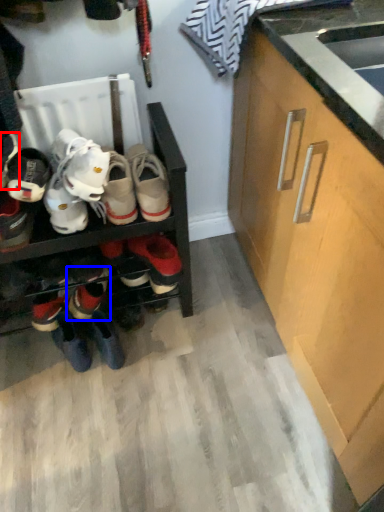
Question: Which object is closer to the camera taking this photo, footwear (highlighted by a red box) or footwear (highlighted by a blue box)?

Choices:
 (A) footwear
 (B) footwear

Answer: (A)